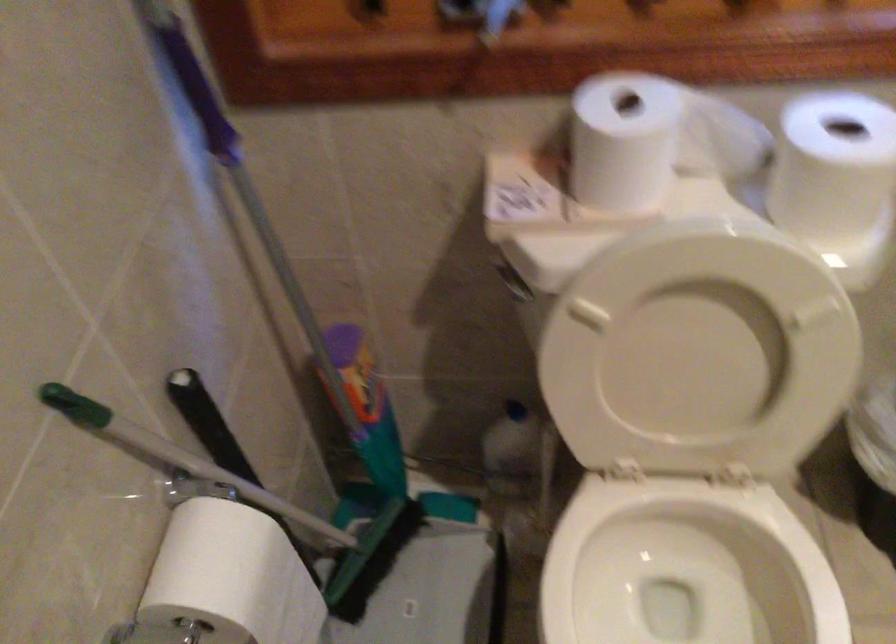
Identify the location of purple top bottle. (367, 408).